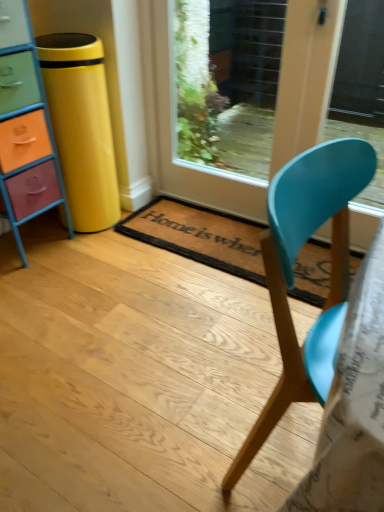
Question: From their relative heights in the image, would you say brown coir mat at center is taller or shorter than matte blue chair at center?

Choices:
 (A) tall
 (B) short

Answer: (B)

Question: Is brown coir mat at center wider or thinner than matte blue chair at center?

Choices:
 (A) wide
 (B) thin

Answer: (A)

Question: Which object is positioned farthest from the matte blue chair at center?

Choices:
 (A) wooden glass door at center
 (B) brown coir mat at center
 (C) multicolored painted wood chest of drawers at left

Answer: (A)

Question: Which is farther from the brown coir mat at center?

Choices:
 (A) wooden glass door at center
 (B) multicolored painted wood chest of drawers at left
 (C) matte blue chair at center

Answer: (C)